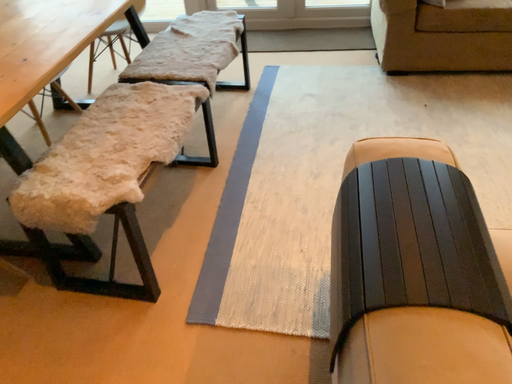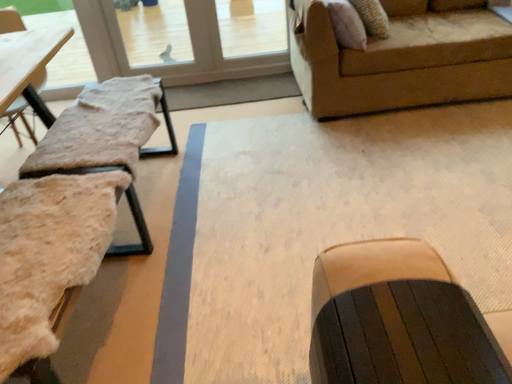
Question: Which way did the camera rotate in the video?

Choices:
 (A) rotated right
 (B) rotated left

Answer: (A)